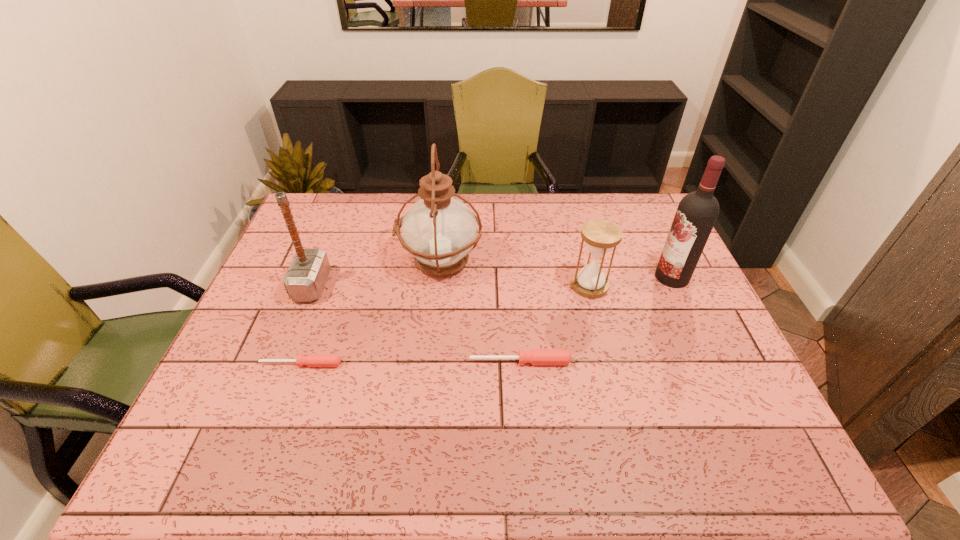
The width and height of the screenshot is (960, 540). In order to click on blank region between the second object from right to left and the shorter screwdriver in this screenshot , I will do `click(445, 325)`.

The image size is (960, 540). What are the coordinates of `vacant area that lies between the hammer and the right screwdriver` in the screenshot? It's located at (416, 323).

Locate an element on the screen. Image resolution: width=960 pixels, height=540 pixels. vacant space that is in between the rightmost object and the hammer is located at coordinates (492, 281).

I want to click on vacant space that's between the fifth object from left to right and the oil lamp, so click(515, 274).

Where is `free point between the hourglass and the fourth shortest object`? The image size is (960, 540). free point between the hourglass and the fourth shortest object is located at coordinates (451, 286).

Select which object appears as the third closest to the wine bottle. Please provide its 2D coordinates. Your answer should be formatted as a tuple, i.e. [(x, y)], where the tuple contains the x and y coordinates of a point satisfying the conditions above.

[(439, 231)]

Choose which object is the fourth nearest neighbor to the third tallest object. Please provide its 2D coordinates. Your answer should be formatted as a tuple, i.e. [(x, y)], where the tuple contains the x and y coordinates of a point satisfying the conditions above.

[(600, 236)]

At what (x,y) coordinates should I click in order to perform the action: click on vacant space that satisfies the following two spatial constraints: 1. on the striking surface of the hammer; 2. on the right side of the right screwdriver. Please return your answer as a coordinate pair (x, y). Looking at the image, I should click on (281, 362).

I want to click on free point that satisfies the following two spatial constraints: 1. on the label of the rightmost object; 2. on the front side of the third shortest object, so click(x=676, y=286).

Identify the location of vacant space that satisfies the following two spatial constraints: 1. on the back side of the taller screwdriver; 2. on the left side of the shortest object. This screenshot has width=960, height=540. (302, 362).